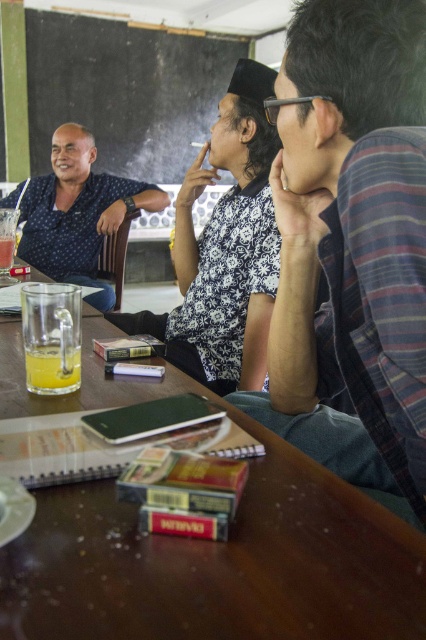
Which of these two, translucent glass at lower left or translucent glass at upper left, stands taller?

translucent glass at upper left is taller.

Who is higher up, translucent glass at lower left or translucent glass at upper left?

Positioned higher is translucent glass at upper left.

Find the location of `translucent glass at lower left`. translucent glass at lower left is located at coordinates (52, 369).

Is white batik shirt at center wider than translucent glass at lower left?

Yes, white batik shirt at center is wider than translucent glass at lower left.

Measure the distance between white batik shirt at center and translucent glass at lower left.

A distance of 29.14 inches exists between white batik shirt at center and translucent glass at lower left.

Locate an element on the screen. This screenshot has height=640, width=426. white batik shirt at center is located at coordinates (224, 248).

Locate an element on the screen. Image resolution: width=426 pixels, height=640 pixels. white batik shirt at center is located at coordinates (224, 248).

Which is below, translucent glass at center or translucent glass at upper left?

translucent glass at center is below.

Can you confirm if translucent glass at center is bigger than translucent glass at upper left?

Indeed, translucent glass at center has a larger size compared to translucent glass at upper left.

What do you see at coordinates (51, 337) in the screenshot?
I see `translucent glass at center` at bounding box center [51, 337].

Image resolution: width=426 pixels, height=640 pixels. What are the coordinates of `translucent glass at center` in the screenshot? It's located at (51, 337).